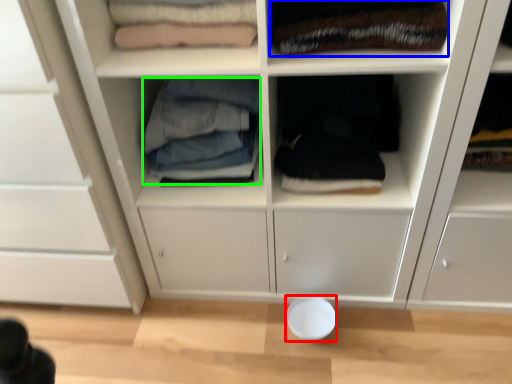
Question: Considering the real-world distances, which object is farthest from bowl (highlighted by a red box)? clothing (highlighted by a blue box) or clothing (highlighted by a green box)?

Choices:
 (A) clothing
 (B) clothing

Answer: (A)